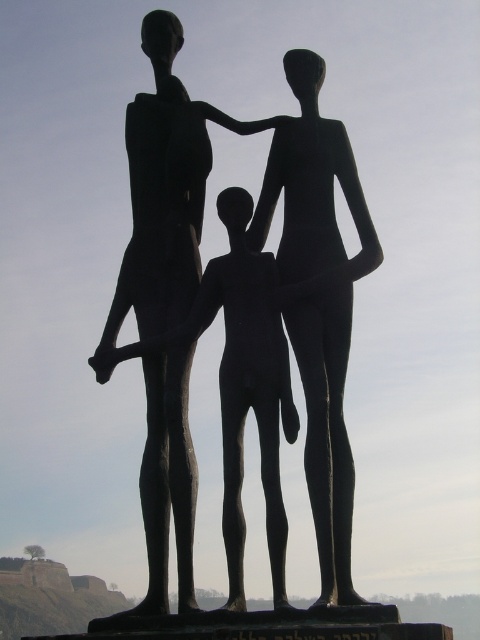
You are an art critic analyzing the sculpture. You notice two points on the sculpture, one at coordinates point (321, 266) and the other at point (335, 552). Which point is closer to your viewpoint?

Point (321, 266) is closer to the viewer than point (335, 552).

From the picture: You are an art curator planning to install a new light fixture in the gallery. The light needs to be placed at point (320, 301) to highlight the bronze statue at center. Can you confirm the exact coordinates where the bronze statue at center is located?

The bronze statue at center is located at point (320, 301).